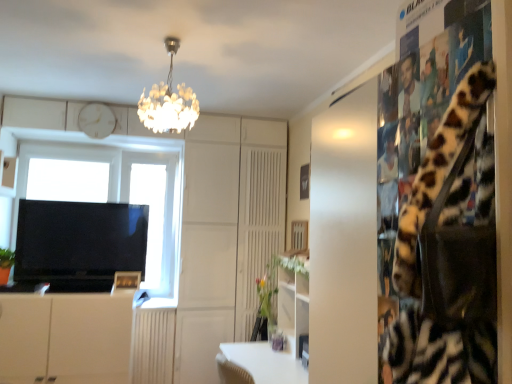
Question: From a real-world perspective, is black glossy tv at left physically located above or below wooden picture frame at lower center?

Choices:
 (A) above
 (B) below

Answer: (A)

Question: Is point (89, 273) positioned closer to the camera than point (118, 283)?

Choices:
 (A) closer
 (B) farther

Answer: (A)

Question: Estimate the real-world distances between objects in this image. Which object is farther from the wooden picture frame at lower center?

Choices:
 (A) transparent glass window at center
 (B) black glossy tv at left
 (C) white matte clock at upper center
 (D) white matte cabinet at lower left
 (E) green matte vase at center

Answer: (C)

Question: Which object is positioned closest to the transparent glass window at center?

Choices:
 (A) white matte cabinet at lower left
 (B) black glossy tv at left
 (C) white glossy computer desk at center
 (D) green matte vase at center
 (E) white matte clock at upper center

Answer: (E)